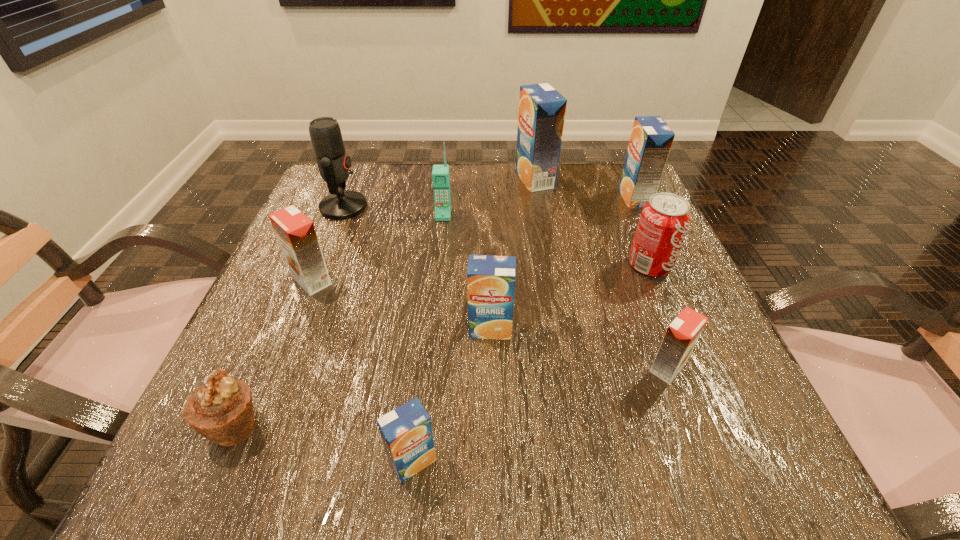
Image resolution: width=960 pixels, height=540 pixels. I want to click on microphone that is at the left edge, so click(333, 163).

Find the location of a particular element. orange juice located in the left edge section of the desktop is located at coordinates pos(296,234).

Where is `muffin that is positioned at the left edge`? muffin that is positioned at the left edge is located at coordinates point(221,410).

Image resolution: width=960 pixels, height=540 pixels. I want to click on soda situated at the right edge, so click(664, 221).

The image size is (960, 540). Find the location of `object that is at the far left corner`. object that is at the far left corner is located at coordinates coord(333,163).

Locate an element on the screen. This screenshot has width=960, height=540. object that is at the near left corner is located at coordinates (221, 410).

What are the coordinates of `object at the far right corner` in the screenshot? It's located at (651, 139).

Image resolution: width=960 pixels, height=540 pixels. In the image, there is a desktop. Identify the location of vacant area at the far edge. (509, 214).

What are the coordinates of `free region at the near edge of the desktop` in the screenshot? It's located at (335, 440).

You are a GUI agent. You are given a task and a screenshot of the screen. Output one action in this format:
    pyautogui.click(x=<x>, y=<y>)
    Task: Click on the blank space at the left edge of the desktop
    
    Given the screenshot: What is the action you would take?
    pyautogui.click(x=289, y=307)